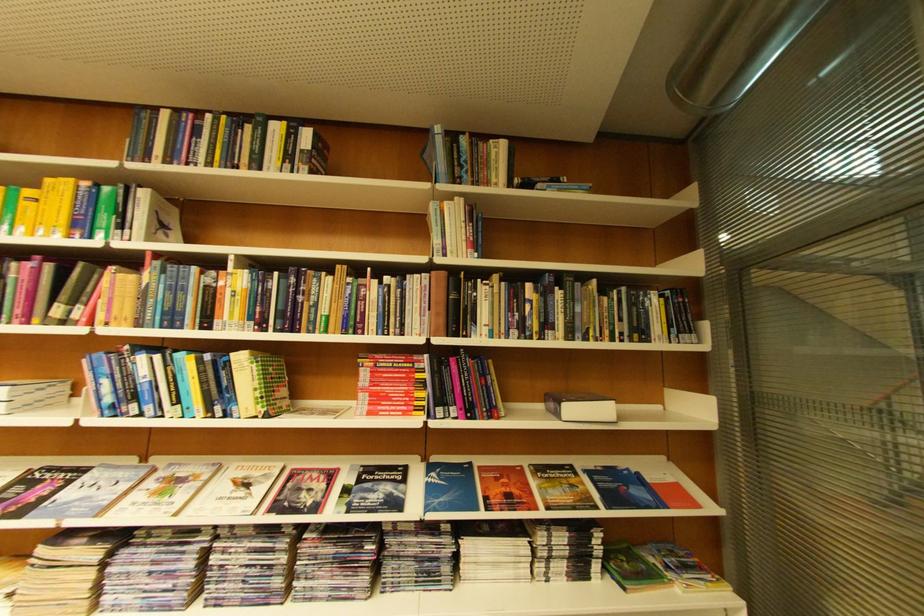
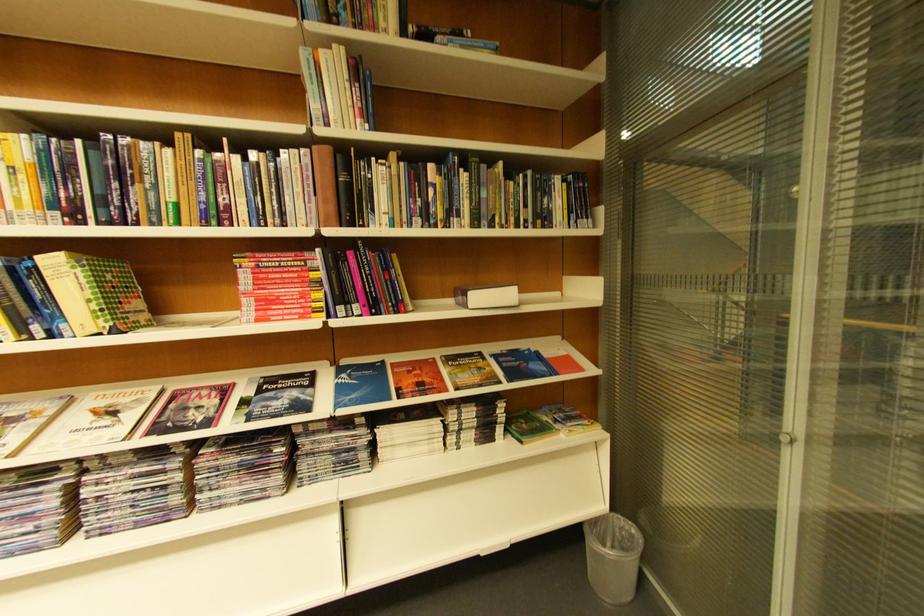
In the second image, find the point that corresponds to pixel 464 411 in the first image.

(367, 310)